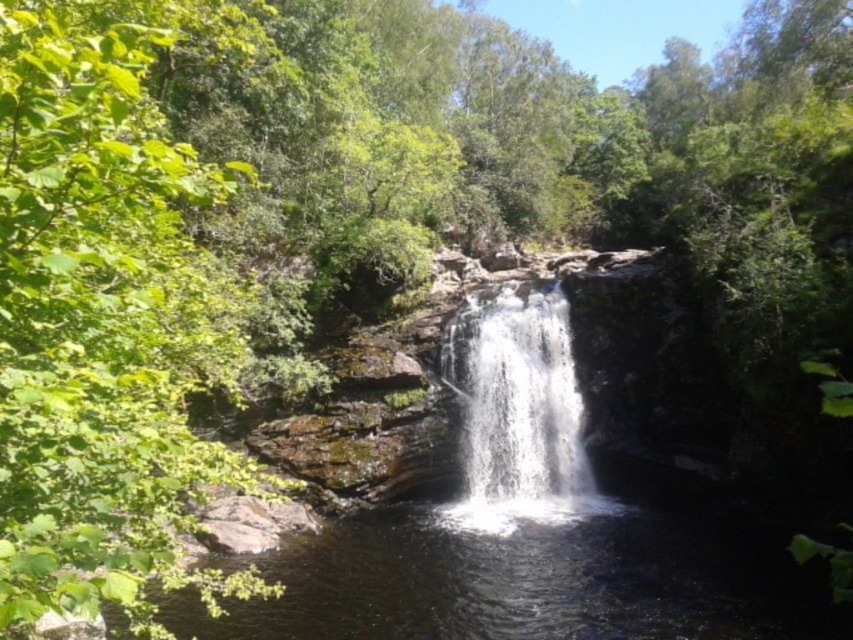
You are standing at the viewpoint where the image was taken and want to reach both the point at coordinates point (96, 346) and the point at coordinates point (469, 486). Which point will you reach first as you move forward?

You will reach point (96, 346) first because it is closer to you than point (469, 486).

You are standing at the center of the waterfall scene. Which direction should you walk to reach the green leafy tree at left?

The green leafy tree at left is located to the left side of the scene, so you should walk towards the left to reach it.